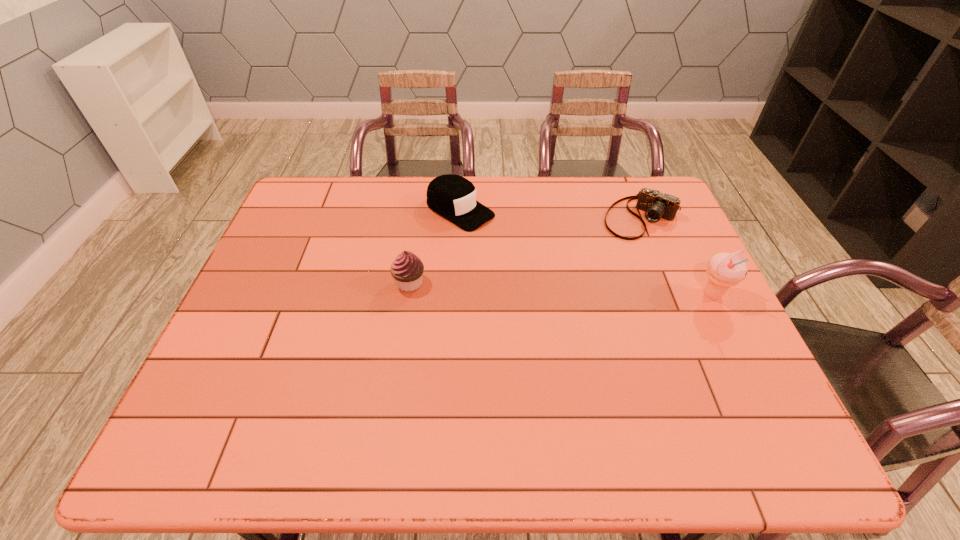
Find the location of a particular element. the second tallest object is located at coordinates (407, 269).

At what (x,y) coordinates should I click in order to perform the action: click on icecream. Please return your answer as a coordinate pair (x, y). This screenshot has width=960, height=540. Looking at the image, I should click on (724, 270).

Image resolution: width=960 pixels, height=540 pixels. I want to click on camera, so click(x=656, y=205).

Image resolution: width=960 pixels, height=540 pixels. I want to click on the second shortest object, so click(453, 197).

At what (x,y) coordinates should I click in order to perform the action: click on free location located on the back of the third shortest object. Please return your answer as a coordinate pair (x, y). Image resolution: width=960 pixels, height=540 pixels. Looking at the image, I should click on (416, 245).

Find the location of `free region located on the back of the icecream`. free region located on the back of the icecream is located at coordinates (691, 252).

I want to click on vacant area located 0.160m on the front-facing side of the shortest object, so click(601, 266).

Where is `vacant space located on the front-facing side of the shortest object`? The height and width of the screenshot is (540, 960). vacant space located on the front-facing side of the shortest object is located at coordinates (614, 248).

This screenshot has width=960, height=540. Identify the location of free space located on the front-facing side of the shortest object. (605, 261).

This screenshot has height=540, width=960. Find the location of `free space located 0.110m on the front-facing side of the cap`. free space located 0.110m on the front-facing side of the cap is located at coordinates (513, 241).